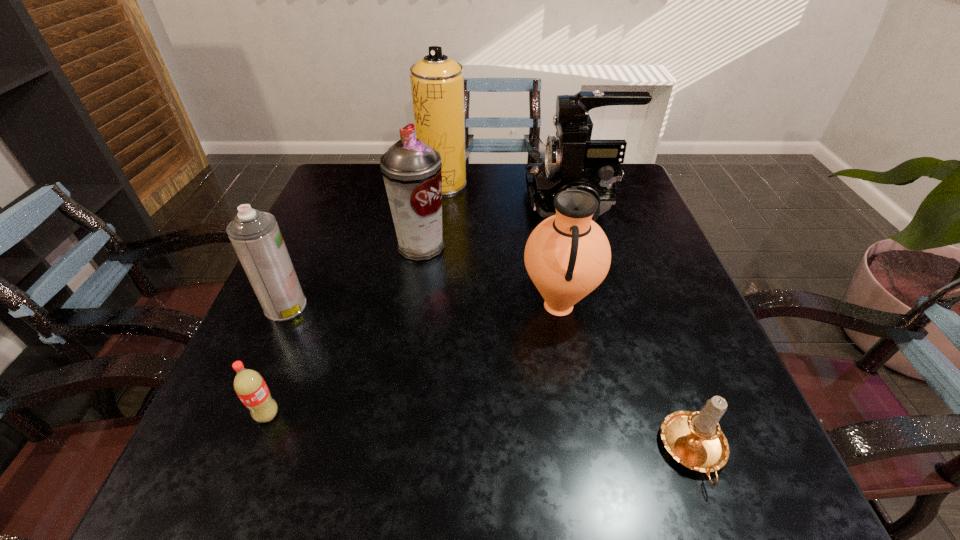
This screenshot has width=960, height=540. I want to click on vacant space positioned 0.120m on the lens mount of the camcorder, so click(481, 206).

Where is `vacant space located 0.170m on the lens mount of the camcorder`? The image size is (960, 540). vacant space located 0.170m on the lens mount of the camcorder is located at coordinates (462, 206).

You are a GUI agent. You are given a task and a screenshot of the screen. Output one action in this format:
    pyautogui.click(x=<x>, y=<y>)
    Task: Click on the vacant region located on the lens mount of the camcorder
    
    Given the screenshot: What is the action you would take?
    pyautogui.click(x=390, y=206)

At what (x,y) coordinates should I click in order to perform the action: click on vacant space situated 0.120m on the back of the second tallest aerosol can. Please return your answer as a coordinate pair (x, y). Looking at the image, I should click on (427, 203).

The image size is (960, 540). I want to click on vacant area located on the back of the pitcher, so click(546, 237).

Locate an element on the screen. This screenshot has width=960, height=540. free region located on the back of the leftmost aerosol can is located at coordinates (329, 206).

I want to click on free space located 0.330m on the back of the soda, so click(x=323, y=271).

Find the location of a particular element. This screenshot has height=540, width=960. blank space located 0.290m on the left of the candle is located at coordinates (472, 452).

Locate an element on the screen. This screenshot has width=960, height=540. aerosol can that is positioned at the far edge is located at coordinates (437, 82).

You are a GUI agent. You are given a task and a screenshot of the screen. Output one action in this format:
    pyautogui.click(x=<x>, y=<y>)
    Task: Click on the camcorder situated at the far edge
    Image resolution: width=960 pixels, height=540 pixels.
    Given the screenshot: What is the action you would take?
    pyautogui.click(x=571, y=158)